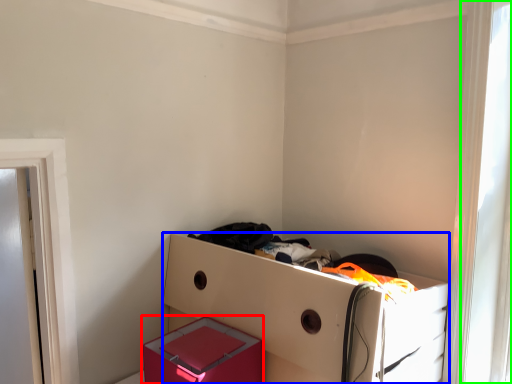
Question: Considering the real-world distances, which object is closest to box (highlighted by a red box)? furniture (highlighted by a blue box) or window (highlighted by a green box).

Choices:
 (A) furniture
 (B) window

Answer: (A)